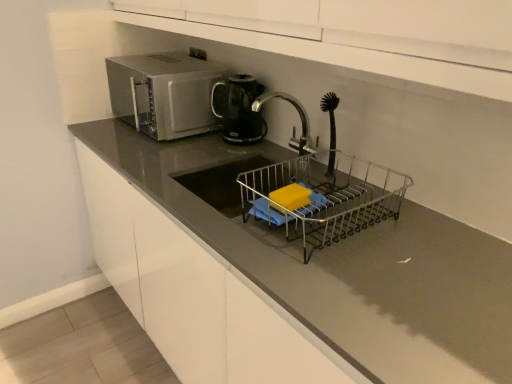
Find the location of a particular element. The width and height of the screenshot is (512, 384). free point to the left of black plastic kettle at upper center is located at coordinates (195, 143).